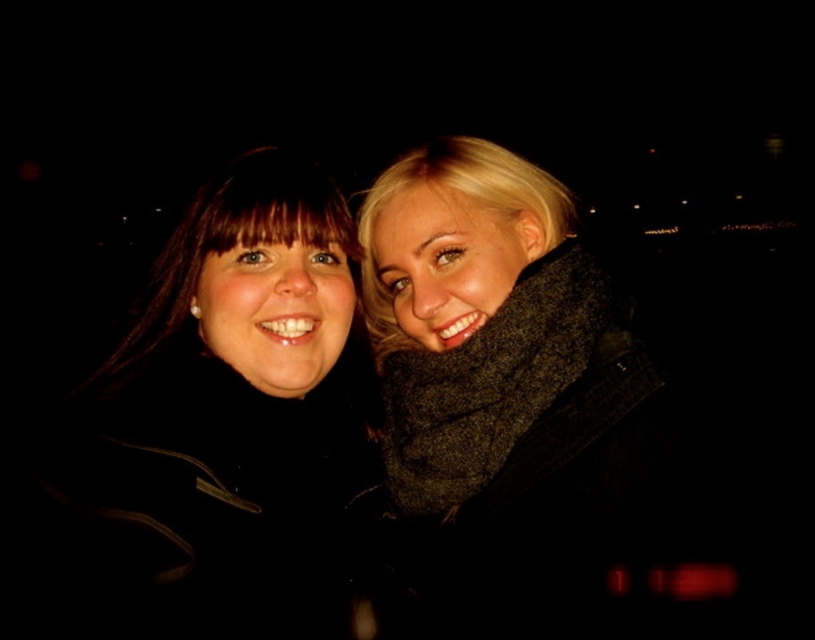
Question: Among these points, which one is farthest from the camera?

Choices:
 (A) (562, 509)
 (B) (300, 337)
 (C) (331, 214)

Answer: (C)

Question: Is dark gray wool scarf at right behind black matte jacket at left?

Choices:
 (A) no
 (B) yes

Answer: (B)

Question: Which point appears closest to the camera in this image?

Choices:
 (A) (327, 189)
 (B) (553, 429)

Answer: (B)

Question: Among these objects, which one is farthest from the camera?

Choices:
 (A) dark gray wool scarf at right
 (B) matte black coat at left
 (C) black matte jacket at left

Answer: (B)

Question: Does dark gray wool scarf at right have a lesser width compared to matte black coat at left?

Choices:
 (A) yes
 (B) no

Answer: (A)

Question: Is dark gray wool scarf at right thinner than black matte jacket at left?

Choices:
 (A) no
 (B) yes

Answer: (B)